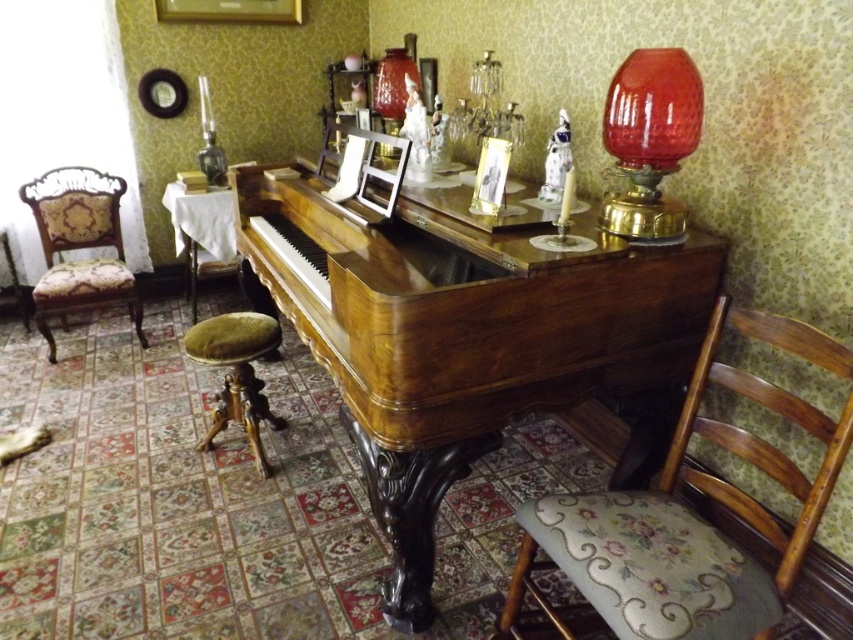
Question: Which point is closer to the camera?

Choices:
 (A) velvet floral-patterned armchair at left
 (B) red glass lampshade at upper center
 (C) matte gold picture frame at upper center

Answer: (B)

Question: Which of the following is the closest to the observer?

Choices:
 (A) red glass lampshade at upper center
 (B) matte gold picture frame at upper center
 (C) ruby glass lampshade at upper right

Answer: (C)

Question: Can you confirm if shiny wood piano at center is smaller than red glass lampshade at upper center?

Choices:
 (A) yes
 (B) no

Answer: (B)

Question: Is shiny wood piano at center to the left of velvet floral-patterned armchair at left from the viewer's perspective?

Choices:
 (A) yes
 (B) no

Answer: (B)

Question: Estimate the real-world distances between objects in this image. Which object is closer to the shiny wood piano at center?

Choices:
 (A) red glass lampshade at upper center
 (B) velvet green stool at center
 (C) wooden floral-patterned chair at lower right
 (D) velvet floral-patterned armchair at left

Answer: (B)

Question: Where is velvet green stool at center located in relation to matte gold picture frame at upper center in the image?

Choices:
 (A) below
 (B) above

Answer: (A)